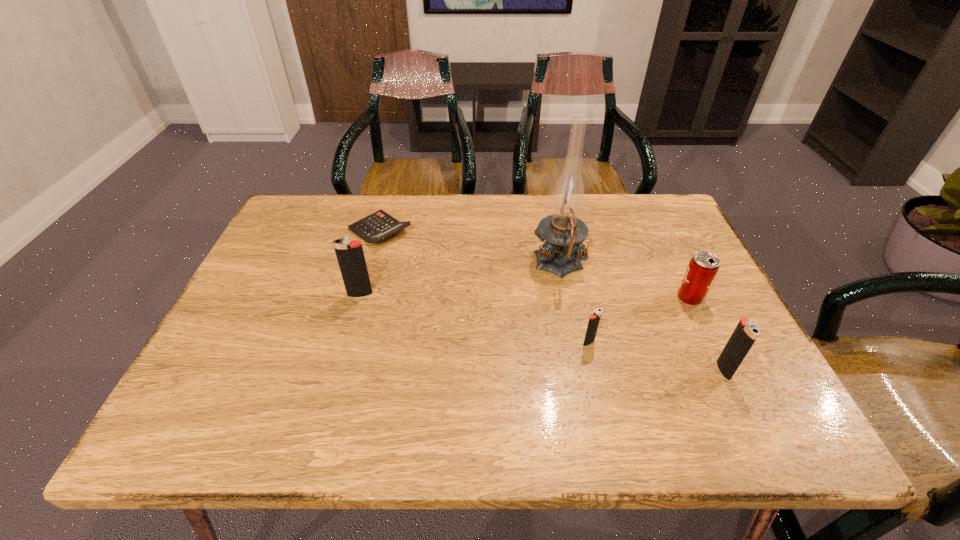
You are a GUI agent. You are given a task and a screenshot of the screen. Output one action in this format:
    pyautogui.click(x=<x>, y=<y>)
    Task: Click on the vacant space at the near edge of the desktop
    The image size is (960, 540).
    Given the screenshot: What is the action you would take?
    pyautogui.click(x=560, y=363)

At what (x,y) coordinates should I click in order to perform the action: click on vacant space at the left edge of the desktop. Please return your answer as a coordinate pair (x, y). Image resolution: width=960 pixels, height=540 pixels. Looking at the image, I should click on (276, 262).

In the image, there is a desktop. At what (x,y) coordinates should I click in order to perform the action: click on vacant space at the far left corner. Please return your answer as a coordinate pair (x, y). The image size is (960, 540). Looking at the image, I should click on (332, 232).

Where is `vacant space at the far right corner of the desktop`? This screenshot has width=960, height=540. vacant space at the far right corner of the desktop is located at coordinates (653, 212).

Locate an element on the screen. free region at the near right corner of the desktop is located at coordinates (685, 368).

Locate an element on the screen. This screenshot has height=540, width=960. unoccupied area between the shortest object and the third tallest object is located at coordinates pyautogui.click(x=552, y=300).

Locate an element on the screen. The image size is (960, 540). free space between the shortest object and the third shortest object is located at coordinates (535, 264).

Locate an element on the screen. The height and width of the screenshot is (540, 960). free space between the fourth tallest object and the tallest object is located at coordinates (624, 281).

The height and width of the screenshot is (540, 960). What are the coordinates of `unoccupied position between the second tallest igniter and the calculator` in the screenshot? It's located at (552, 300).

The image size is (960, 540). In order to click on vacant space that's between the second igniter from left to right and the beer can in this screenshot , I will do `click(639, 320)`.